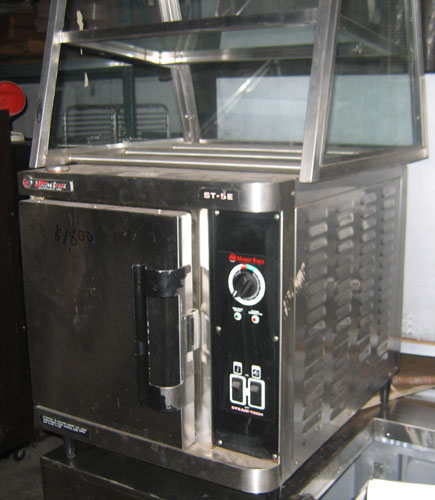
Locate an element on the screen. black switches is located at coordinates (236, 387), (255, 395).